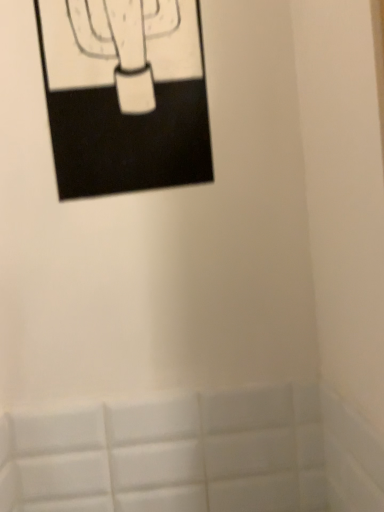
Question: Is black matte picture frame at upper left located within white matte tile at lower center?

Choices:
 (A) no
 (B) yes

Answer: (A)

Question: Is white matte tile at lower center closer to the viewer compared to black matte picture frame at upper left?

Choices:
 (A) yes
 (B) no

Answer: (B)

Question: Can you confirm if white matte tile at lower center is thinner than black matte picture frame at upper left?

Choices:
 (A) no
 (B) yes

Answer: (B)

Question: Are white matte tile at lower center and black matte picture frame at upper left beside each other?

Choices:
 (A) yes
 (B) no

Answer: (B)

Question: Is white matte tile at lower center taller than black matte picture frame at upper left?

Choices:
 (A) no
 (B) yes

Answer: (A)

Question: Is white matte tile at lower center positioned with its back to black matte picture frame at upper left?

Choices:
 (A) no
 (B) yes

Answer: (A)

Question: Considering the relative sizes of black matte picture frame at upper left and white matte tile at lower center in the image provided, is black matte picture frame at upper left thinner than white matte tile at lower center?

Choices:
 (A) yes
 (B) no

Answer: (B)

Question: From a real-world perspective, is black matte picture frame at upper left physically above white matte tile at lower center?

Choices:
 (A) no
 (B) yes

Answer: (B)

Question: Is black matte picture frame at upper left completely or partially outside of white matte tile at lower center?

Choices:
 (A) yes
 (B) no

Answer: (A)

Question: Does black matte picture frame at upper left have a greater width compared to white matte tile at lower center?

Choices:
 (A) no
 (B) yes

Answer: (B)

Question: Can you confirm if black matte picture frame at upper left is smaller than white matte tile at lower center?

Choices:
 (A) yes
 (B) no

Answer: (B)

Question: Is black matte picture frame at upper left looking in the opposite direction of white matte tile at lower center?

Choices:
 (A) yes
 (B) no

Answer: (B)

Question: From the image's perspective, relative to black matte picture frame at upper left, is white matte tile at lower center above or below?

Choices:
 (A) below
 (B) above

Answer: (A)